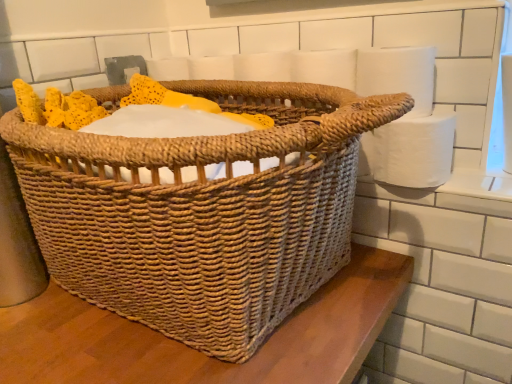
This screenshot has height=384, width=512. I want to click on white matte toilet paper at upper right, acting as the 1th toilet paper starting from the top, so tap(398, 75).

The width and height of the screenshot is (512, 384). In order to click on white matte toilet paper at upper right, placed as the 2th toilet paper when sorted from bottom to top in this screenshot , I will do [398, 75].

Considering the points (383, 51) and (199, 197), which point is in front, point (383, 51) or point (199, 197)?

Point (199, 197)

Does white matte toilet paper at upper right, acting as the 1th toilet paper starting from the top, have a greater width compared to woven natural picnic basket at center?

In fact, white matte toilet paper at upper right, acting as the 1th toilet paper starting from the top, might be narrower than woven natural picnic basket at center.

Is white matte toilet paper at upper right, acting as the 1th toilet paper starting from the top, oriented away from woven natural picnic basket at center?

No.

What's the angular difference between woven natural picnic basket at center and white paper at right, placed as the 1th toilet paper when sorted from bottom to top,'s facing directions?

woven natural picnic basket at center and white paper at right, placed as the 1th toilet paper when sorted from bottom to top, are facing 0.00123 degrees away from each other.

From the image's perspective, is woven natural picnic basket at center beneath white paper at right, placed as the 1th toilet paper when sorted from bottom to top?

Yes, from the image's perspective, woven natural picnic basket at center is beneath white paper at right, placed as the 1th toilet paper when sorted from bottom to top.

Is woven natural picnic basket at center bigger or smaller than white paper at right, placed as the 1th toilet paper when sorted from bottom to top?

woven natural picnic basket at center is bigger than white paper at right, placed as the 1th toilet paper when sorted from bottom to top.

Is woven natural picnic basket at center spatially inside white paper at right, placed as the 1th toilet paper when sorted from bottom to top, or outside of it?

woven natural picnic basket at center is not inside white paper at right, placed as the 1th toilet paper when sorted from bottom to top, it's outside.

Considering the sizes of woven natural picnic basket at center and white matte toilet paper at upper right, acting as the 1th toilet paper starting from the top, in the image, is woven natural picnic basket at center wider or thinner than white matte toilet paper at upper right, acting as the 1th toilet paper starting from the top,?

In the image, woven natural picnic basket at center appears to be wider than white matte toilet paper at upper right, acting as the 1th toilet paper starting from the top.

Can white matte toilet paper at upper right, placed as the 2th toilet paper when sorted from bottom to top, be found inside woven natural picnic basket at center?

No, white matte toilet paper at upper right, placed as the 2th toilet paper when sorted from bottom to top, is not inside woven natural picnic basket at center.

Who is taller, woven natural picnic basket at center or white matte toilet paper at upper right, acting as the 1th toilet paper starting from the top?

Standing taller between the two is woven natural picnic basket at center.

From the image's perspective, would you say white paper at right, which ranks as the second toilet paper in top-to-bottom order, is positioned over white matte toilet paper at upper right, acting as the 1th toilet paper starting from the top?

No.

Is white paper at right, which ranks as the second toilet paper in top-to-bottom order, to the left of white matte toilet paper at upper right, placed as the 2th toilet paper when sorted from bottom to top, from the viewer's perspective?

In fact, white paper at right, which ranks as the second toilet paper in top-to-bottom order, is to the right of white matte toilet paper at upper right, placed as the 2th toilet paper when sorted from bottom to top.

Is point (448, 115) closer or farther from the camera than point (404, 82)?

Point (448, 115) is farther from the camera than point (404, 82).

The height and width of the screenshot is (384, 512). I want to click on toilet paper that appears on the right of white matte toilet paper at upper right, acting as the 1th toilet paper starting from the top, so click(410, 151).

Considering the positions of objects white matte toilet paper at upper right, acting as the 1th toilet paper starting from the top, and white paper at right, which ranks as the second toilet paper in top-to-bottom order, in the image provided, who is more to the left, white matte toilet paper at upper right, acting as the 1th toilet paper starting from the top, or white paper at right, which ranks as the second toilet paper in top-to-bottom order,?

white matte toilet paper at upper right, acting as the 1th toilet paper starting from the top.

From a real-world perspective, who is located lower, white matte toilet paper at upper right, acting as the 1th toilet paper starting from the top, or white paper at right, which ranks as the second toilet paper in top-to-bottom order?

white paper at right, which ranks as the second toilet paper in top-to-bottom order.

Is white matte toilet paper at upper right, acting as the 1th toilet paper starting from the top, bigger or smaller than white paper at right, placed as the 1th toilet paper when sorted from bottom to top?

Considering their sizes, white matte toilet paper at upper right, acting as the 1th toilet paper starting from the top, takes up less space than white paper at right, placed as the 1th toilet paper when sorted from bottom to top.

Would you say white matte toilet paper at upper right, acting as the 1th toilet paper starting from the top, is a long distance from white paper at right, placed as the 1th toilet paper when sorted from bottom to top?

They are positioned close to each other.

Does white paper at right, which ranks as the second toilet paper in top-to-bottom order, have a lesser width compared to woven natural picnic basket at center?

Yes, white paper at right, which ranks as the second toilet paper in top-to-bottom order, is thinner than woven natural picnic basket at center.

How distant is white paper at right, which ranks as the second toilet paper in top-to-bottom order, from woven natural picnic basket at center?

white paper at right, which ranks as the second toilet paper in top-to-bottom order, is 13.21 inches away from woven natural picnic basket at center.

Looking at this image, is the surface of white paper at right, which ranks as the second toilet paper in top-to-bottom order, in direct contact with woven natural picnic basket at center?

No, white paper at right, which ranks as the second toilet paper in top-to-bottom order, is not with woven natural picnic basket at center.

I want to click on the 2nd toilet paper above the woven natural picnic basket at center (from the image's perspective), so click(398, 75).

Identify the location of picnic basket in front of the white paper at right, which ranks as the second toilet paper in top-to-bottom order. This screenshot has width=512, height=384. (203, 212).

Considering their positions, is woven natural picnic basket at center positioned further to white paper at right, which ranks as the second toilet paper in top-to-bottom order, than white matte toilet paper at upper right, acting as the 1th toilet paper starting from the top?

The object further to white paper at right, which ranks as the second toilet paper in top-to-bottom order, is woven natural picnic basket at center.

From the image, which object appears to be nearer to woven natural picnic basket at center, white matte toilet paper at upper right, acting as the 1th toilet paper starting from the top, or white paper at right, placed as the 1th toilet paper when sorted from bottom to top?

The object closer to woven natural picnic basket at center is white paper at right, placed as the 1th toilet paper when sorted from bottom to top.

Estimate the real-world distances between objects in this image. Which object is further from woven natural picnic basket at center, white paper at right, placed as the 1th toilet paper when sorted from bottom to top, or white matte toilet paper at upper right, acting as the 1th toilet paper starting from the top?

Based on the image, white matte toilet paper at upper right, acting as the 1th toilet paper starting from the top, appears to be further to woven natural picnic basket at center.

Estimate the real-world distances between objects in this image. Which object is further from white paper at right, placed as the 1th toilet paper when sorted from bottom to top, white matte toilet paper at upper right, placed as the 2th toilet paper when sorted from bottom to top, or woven natural picnic basket at center?

woven natural picnic basket at center.

Considering their positions, is white paper at right, which ranks as the second toilet paper in top-to-bottom order, positioned further to white matte toilet paper at upper right, placed as the 2th toilet paper when sorted from bottom to top, than woven natural picnic basket at center?

woven natural picnic basket at center is positioned further to the anchor white matte toilet paper at upper right, placed as the 2th toilet paper when sorted from bottom to top.

In the scene shown: From the image, which object appears to be nearer to white matte toilet paper at upper right, acting as the 1th toilet paper starting from the top, woven natural picnic basket at center or white paper at right, placed as the 1th toilet paper when sorted from bottom to top?

Based on the image, white paper at right, placed as the 1th toilet paper when sorted from bottom to top, appears to be nearer to white matte toilet paper at upper right, acting as the 1th toilet paper starting from the top.

The image size is (512, 384). Find the location of `toilet paper positioned between woven natural picnic basket at center and white paper at right, which ranks as the second toilet paper in top-to-bottom order, from near to far`. toilet paper positioned between woven natural picnic basket at center and white paper at right, which ranks as the second toilet paper in top-to-bottom order, from near to far is located at coordinates (398, 75).